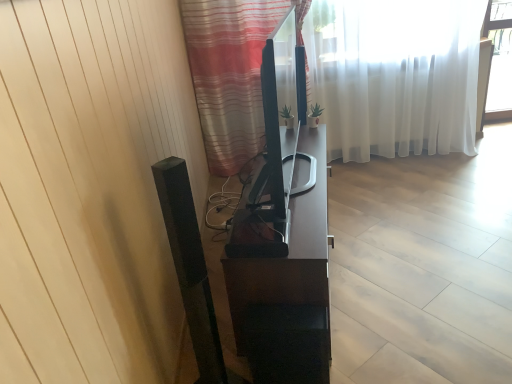
Question: Considering the positions of point (194, 44) and point (308, 11), is point (194, 44) closer or farther from the camera than point (308, 11)?

Choices:
 (A) closer
 (B) farther

Answer: (B)

Question: From the image's perspective, is striped fabric curtain at center, which is counted as the first curtain, starting from the front, positioned above or below white sheer curtain at upper center, marked as the 1th curtain in a back-to-front arrangement?

Choices:
 (A) above
 (B) below

Answer: (B)

Question: Estimate the real-world distances between objects in this image. Which object is closer to the striped fabric curtain at center, which is counted as the first curtain, starting from the front?

Choices:
 (A) white sheer curtain at upper center, marked as the 1th curtain in a back-to-front arrangement
 (B) satin black tv stand at center

Answer: (A)

Question: Estimate the real-world distances between objects in this image. Which object is farther from the striped fabric curtain at center, which is counted as the first curtain, starting from the front?

Choices:
 (A) white sheer curtain at upper center, marked as the 1th curtain in a back-to-front arrangement
 (B) satin black tv stand at center

Answer: (B)